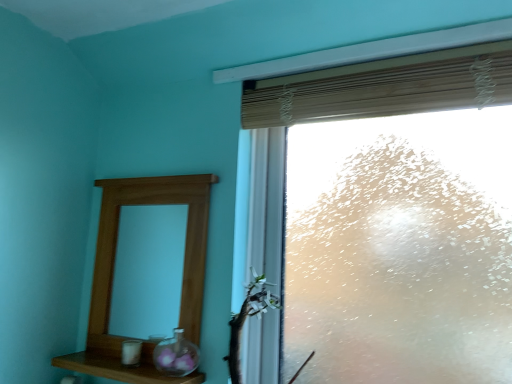
Question: Is wooden mirror at left outside green leafy branch at lower right?

Choices:
 (A) yes
 (B) no

Answer: (A)

Question: Is wooden mirror at left far away from green leafy branch at lower right?

Choices:
 (A) yes
 (B) no

Answer: (B)

Question: From a real-world perspective, does wooden mirror at left stand above green leafy branch at lower right?

Choices:
 (A) yes
 (B) no

Answer: (A)

Question: From the image's perspective, is wooden mirror at left on top of green leafy branch at lower right?

Choices:
 (A) no
 (B) yes

Answer: (B)

Question: Considering the relative sizes of wooden mirror at left and green leafy branch at lower right in the image provided, is wooden mirror at left shorter than green leafy branch at lower right?

Choices:
 (A) no
 (B) yes

Answer: (A)

Question: In terms of size, does wooden mirror at left appear bigger or smaller than wooden blind at upper right?

Choices:
 (A) small
 (B) big

Answer: (B)

Question: Is wooden mirror at left in front of or behind wooden blind at upper right in the image?

Choices:
 (A) front
 (B) behind

Answer: (B)

Question: From a real-world perspective, relative to wooden blind at upper right, is wooden mirror at left vertically above or below?

Choices:
 (A) above
 (B) below

Answer: (B)

Question: Considering the positions of point (114, 226) and point (348, 69), is point (114, 226) closer or farther from the camera than point (348, 69)?

Choices:
 (A) farther
 (B) closer

Answer: (A)

Question: Does point (88, 360) appear closer or farther from the camera than point (94, 370)?

Choices:
 (A) closer
 (B) farther

Answer: (B)

Question: From their relative heights in the image, would you say wooden mirror at left is taller or shorter than wooden shelf at lower left?

Choices:
 (A) tall
 (B) short

Answer: (A)

Question: Considering their positions, is wooden mirror at left located in front of or behind wooden shelf at lower left?

Choices:
 (A) behind
 (B) front

Answer: (A)

Question: Choose the correct answer: Is wooden mirror at left inside wooden shelf at lower left or outside it?

Choices:
 (A) outside
 (B) inside

Answer: (A)

Question: Based on their positions, is frosted glass window at upper right located to the left or right of green leafy branch at lower right?

Choices:
 (A) right
 (B) left

Answer: (A)

Question: From a real-world perspective, is frosted glass window at upper right above or below green leafy branch at lower right?

Choices:
 (A) above
 (B) below

Answer: (A)